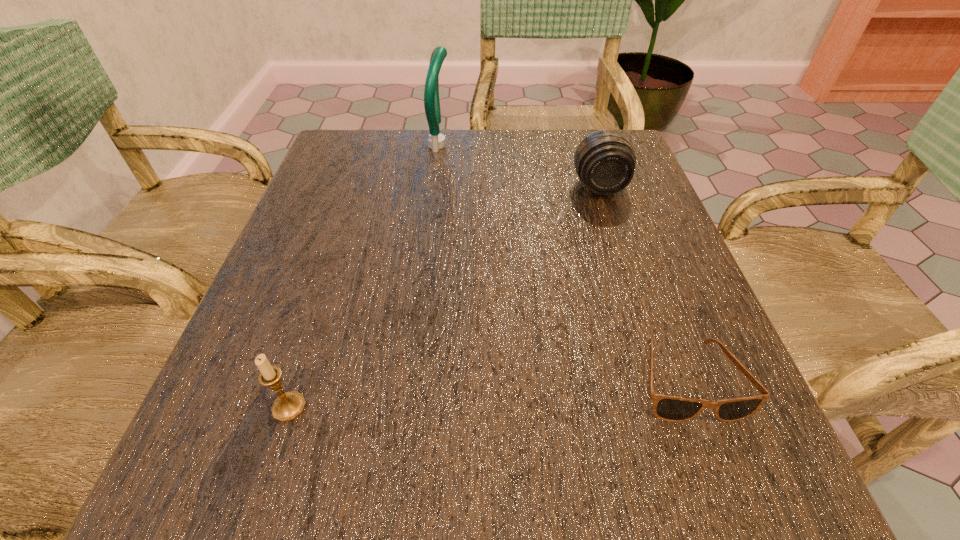
Identify the location of telephoto lens that is at the far edge. The height and width of the screenshot is (540, 960). (605, 161).

In order to click on object that is at the left edge in this screenshot , I will do `click(289, 405)`.

I want to click on telephoto lens at the right edge, so click(x=605, y=161).

Where is `sunglasses situated at the right edge`? This screenshot has height=540, width=960. sunglasses situated at the right edge is located at coordinates (669, 408).

The image size is (960, 540). I want to click on object that is at the far right corner, so click(605, 161).

In the image, there is a desktop. Where is `blank space at the far edge`? This screenshot has width=960, height=540. blank space at the far edge is located at coordinates (415, 152).

What are the coordinates of `free region at the near edge` in the screenshot? It's located at (551, 467).

Identify the location of vacant space at the left edge. The height and width of the screenshot is (540, 960). (316, 231).

At what (x,y) coordinates should I click in order to perform the action: click on vacant area at the right edge. Please return your answer as a coordinate pair (x, y). This screenshot has width=960, height=540. Looking at the image, I should click on (685, 313).

This screenshot has width=960, height=540. Identify the location of vacant space at the near left corner of the desktop. (224, 497).